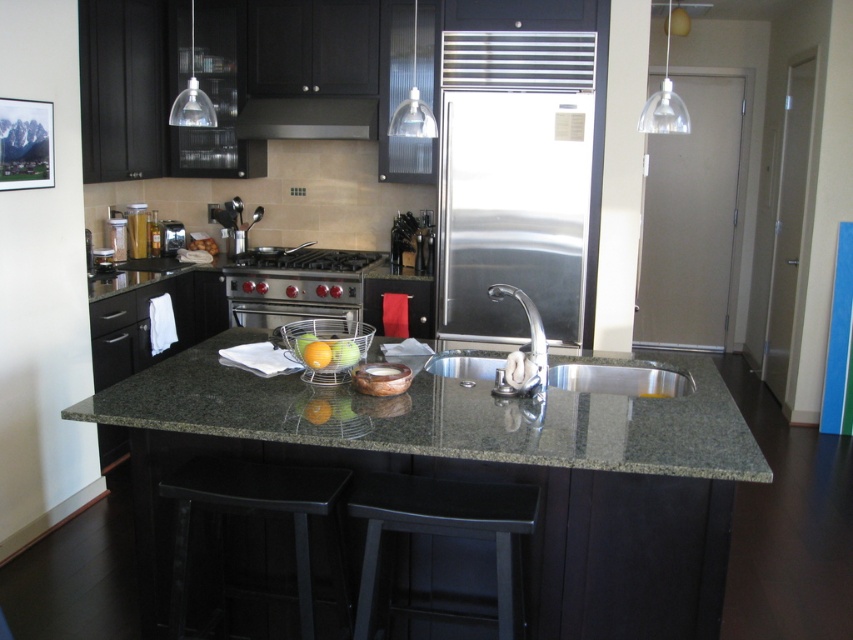
You are standing in the kitchen and want to reach both the point at coordinates point (469, 400) and the point at coordinates point (520, 381). Which point will you reach first?

You will reach point (469, 400) first because it is closer to you than point (520, 381).

Looking at this image, you are standing in the kitchen and want to place a hot pan on the closest surface. Which object should you choose between the green granite countertop at center and the black matte exhaust hood at upper center?

The green granite countertop at center is closer to the viewer, so you should place the hot pan on the green granite countertop at center.

Based on the photo, you are standing in the kitchen and want to place a new spice rack on the counter. Based on the image, where exactly should you place the spice rack to ensure it aligns with the center of the green granite countertop at center?

The green granite countertop at center is located at coordinates point (444, 417), so placing the spice rack at those coordinates would align it with the center of the green granite countertop at center.